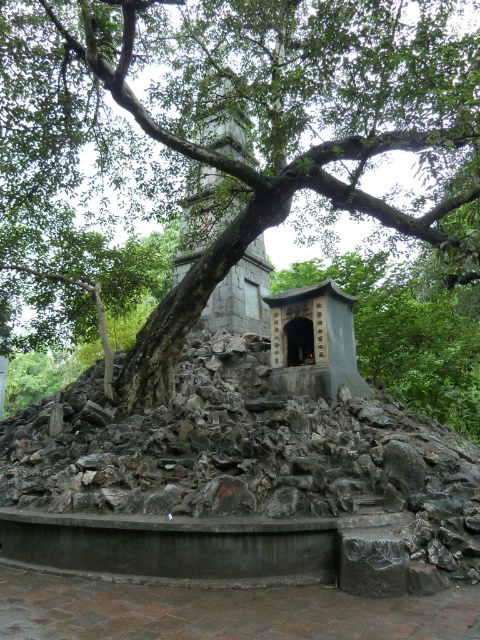
Can you confirm if green leafy tree at center is shorter than gray stone tower at center?

In fact, green leafy tree at center may be taller than gray stone tower at center.

Does green leafy tree at center appear on the right side of gray stone tower at center?

In fact, green leafy tree at center is to the left of gray stone tower at center.

Which is behind, point (127, 49) or point (205, 173)?

Positioned behind is point (205, 173).

Find the location of a particular element. The height and width of the screenshot is (640, 480). green leafy tree at center is located at coordinates (216, 140).